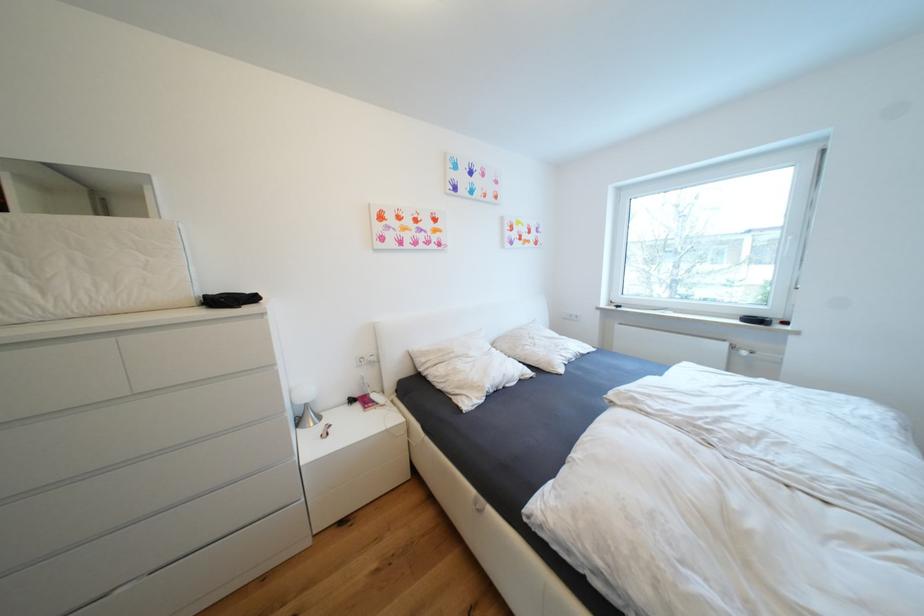
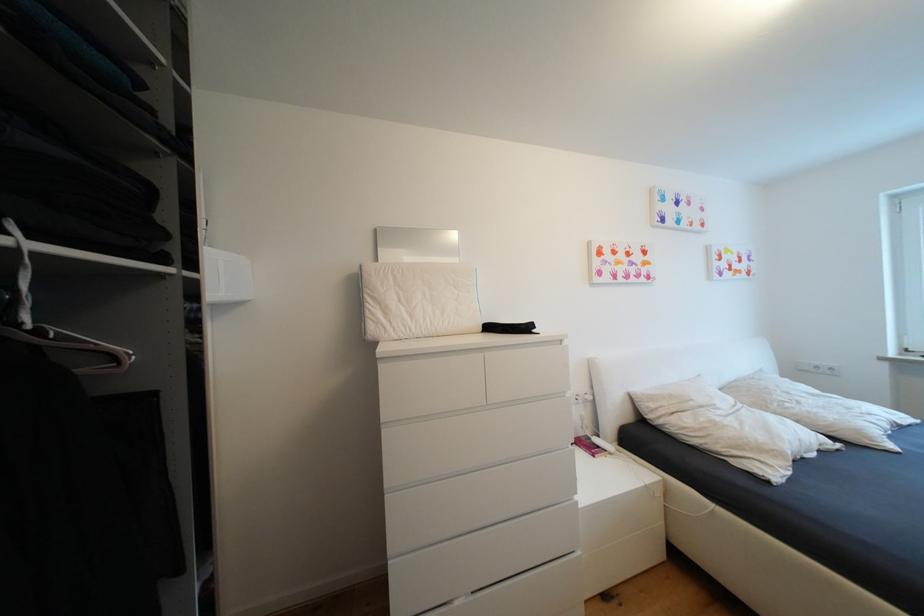
Question: The images are taken continuously from a first-person perspective. In which direction is your viewpoint rotating?

Choices:
 (A) Left
 (B) Right
 (C) Up
 (D) Down

Answer: (A)